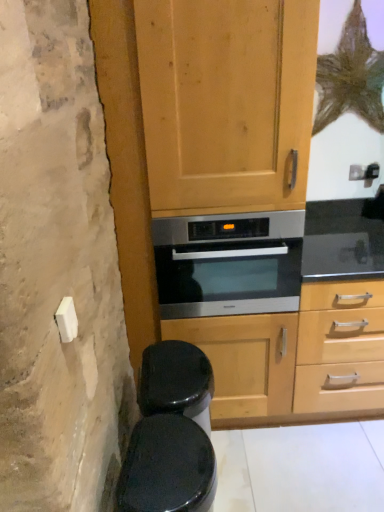
Find the location of a particular element. vacant area on top of black glossy toilet bowl at lower left (from a real-world perspective) is located at coordinates (167, 459).